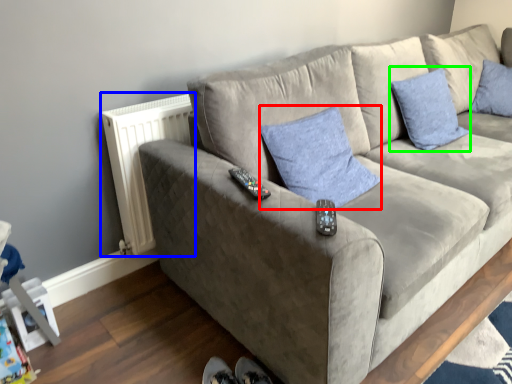
Question: Estimate the real-world distances between objects in this image. Which object is farther from pillow (highlighted by a red box), radiator (highlighted by a blue box) or pillow (highlighted by a green box)?

Choices:
 (A) radiator
 (B) pillow

Answer: (B)